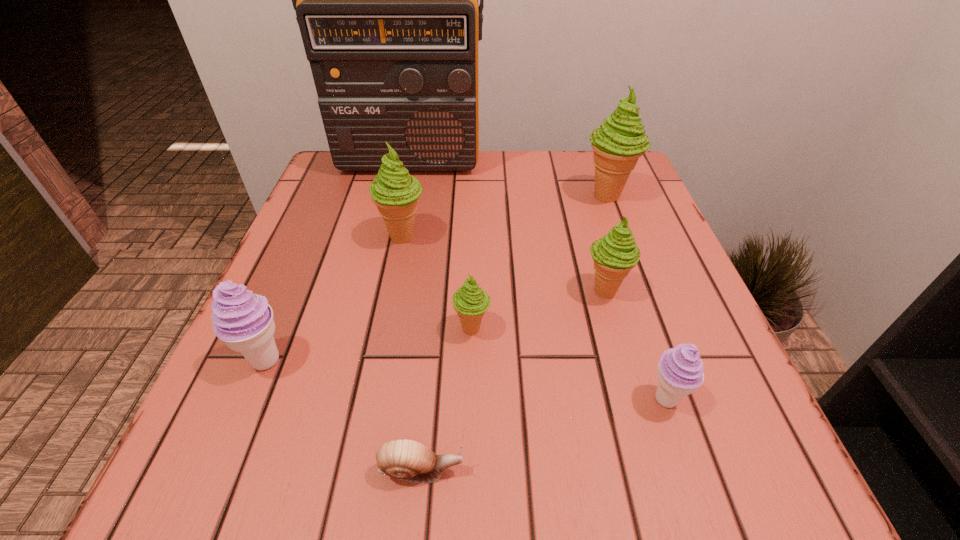
In order to click on free space located on the back of the smallest green icecream in this screenshot , I will do `click(472, 294)`.

I want to click on blank area located on the front of the right purple icecream, so click(691, 476).

In order to click on vacant space located 0.100m on the front-facing side of the shortest object in this screenshot , I will do `click(541, 470)`.

Locate an element on the screen. The image size is (960, 540). radio receiver that is at the far edge is located at coordinates (386, 0).

In order to click on icecream that is at the far edge in this screenshot , I will do `click(618, 143)`.

The image size is (960, 540). Identify the location of object positioned at the near edge. [405, 459].

This screenshot has width=960, height=540. I want to click on radio receiver that is at the left edge, so click(386, 0).

Where is `icecream at the left edge`? This screenshot has width=960, height=540. icecream at the left edge is located at coordinates (244, 321).

I want to click on object present at the far left corner, so click(386, 0).

In order to click on object situated at the far right corner in this screenshot , I will do `click(618, 143)`.